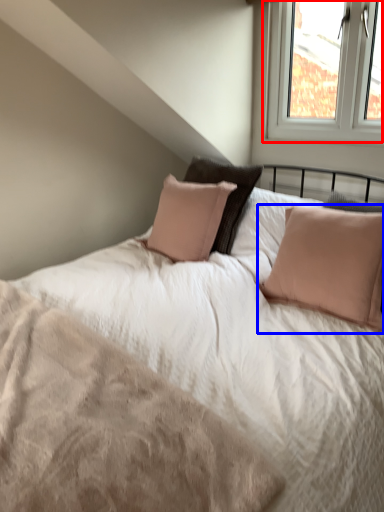
Question: Which object is further to the camera taking this photo, window (highlighted by a red box) or pillow (highlighted by a blue box)?

Choices:
 (A) window
 (B) pillow

Answer: (A)